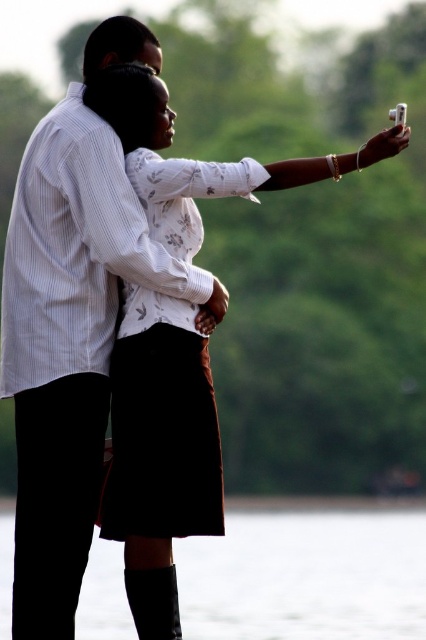
Based on the scene described, which object is positioned lower in the image between the black leather boots at lower center and the white floral blouse at upper center?

The black leather boots at lower center is positioned lower in the image compared to the white floral blouse at upper center.

You are trying to determine the relative positions of the black leather boots at lower center and the white floral blouse at upper center in the image. Which object is positioned higher up in the image?

The white floral blouse at upper center is positioned higher up in the image than the black leather boots at lower center.